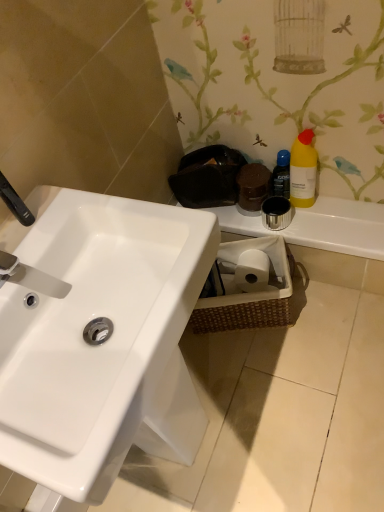
Question: Considering the positions of white glossy sink at center and blue glossy bottle at upper right in the image, is white glossy sink at center bigger or smaller than blue glossy bottle at upper right?

Choices:
 (A) big
 (B) small

Answer: (A)

Question: Considering the positions of white glossy sink at center and blue glossy bottle at upper right in the image, is white glossy sink at center taller or shorter than blue glossy bottle at upper right?

Choices:
 (A) short
 (B) tall

Answer: (B)

Question: Estimate the real-world distances between objects in this image. Which object is closer to the woven brown basket at lower right?

Choices:
 (A) matte silver faucet at left, the 1th plumbing fixture when ordered from bottom to top
 (B) white glossy sink at center
 (C) metallic silver cup at upper right
 (D) blue glossy bottle at upper right
 (E) yellow matte bottle at upper right

Answer: (C)

Question: Considering the real-world distances, which object is closest to the metallic silver cup at upper right?

Choices:
 (A) blue glossy bottle at upper right
 (B) woven brown basket at lower right
 (C) yellow matte bottle at upper right
 (D) white glossy sink at center
 (E) matte silver faucet at left, the 1th plumbing fixture when ordered from bottom to top

Answer: (C)